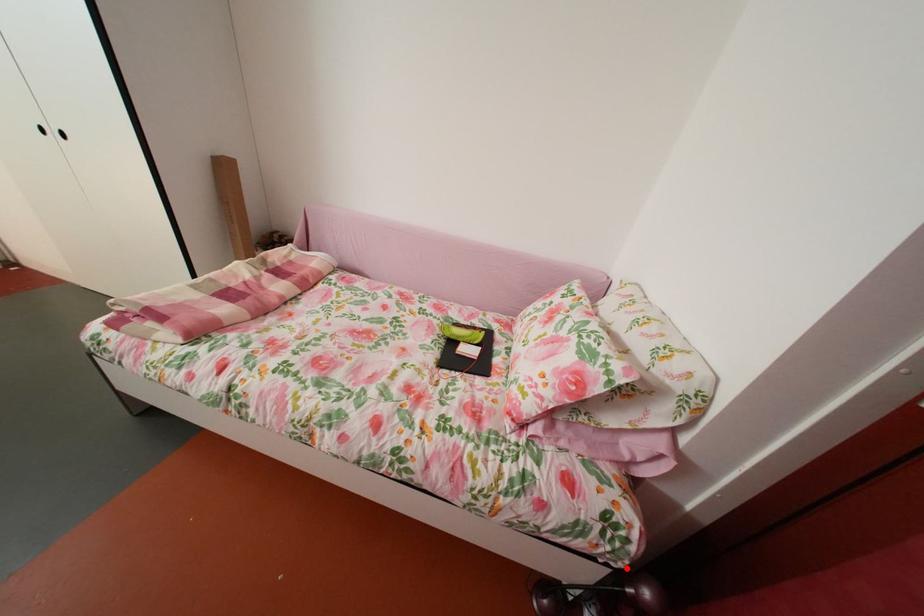
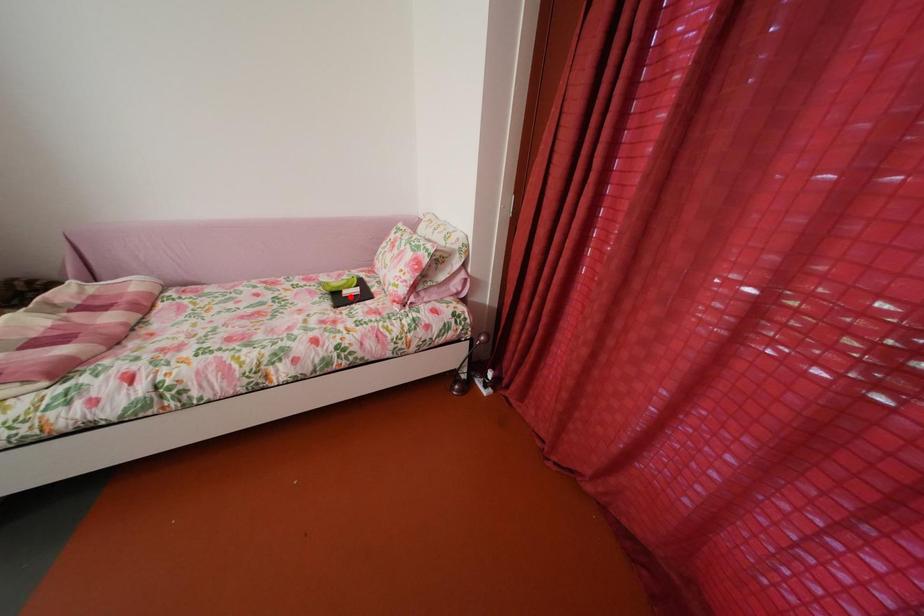
I am providing you with two images of the same scene from different viewpoints. A red point is marked on the first image and another point is marked on the second image. Do the highlighted points in image1 and image2 indicate the same real-world spot?

No